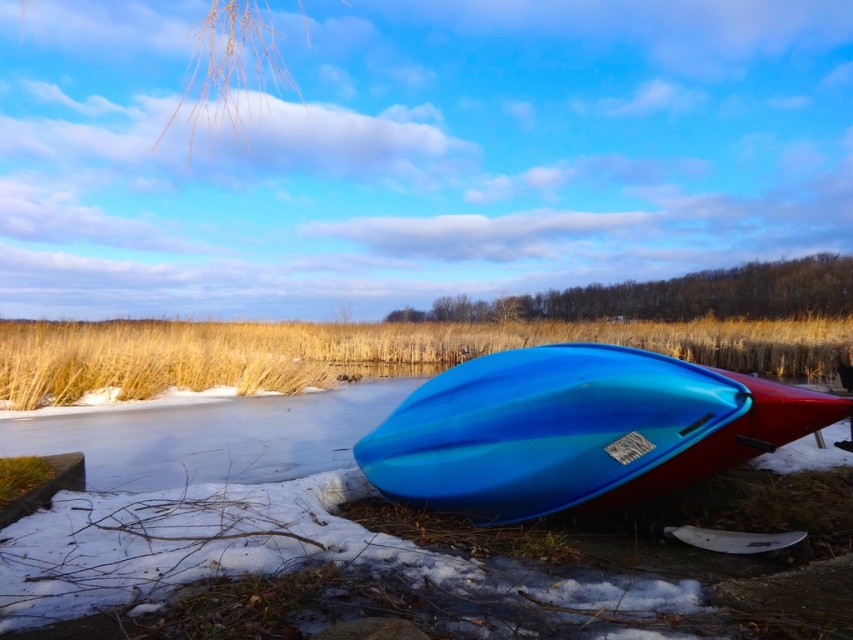
You are standing at the edge of the frozen lake and see the point marked at coordinates (577, 429). Which object is this point located on?

The point marked at coordinates (577, 429) is located on the blue glossy kayak at center.

You are an observer standing at the edge of the frozen lake. You see the blue glossy kayak at center and the golden dry grass at lower center. Which object is taller when viewed from your perspective?

The golden dry grass at lower center is taller than the blue glossy kayak at center.